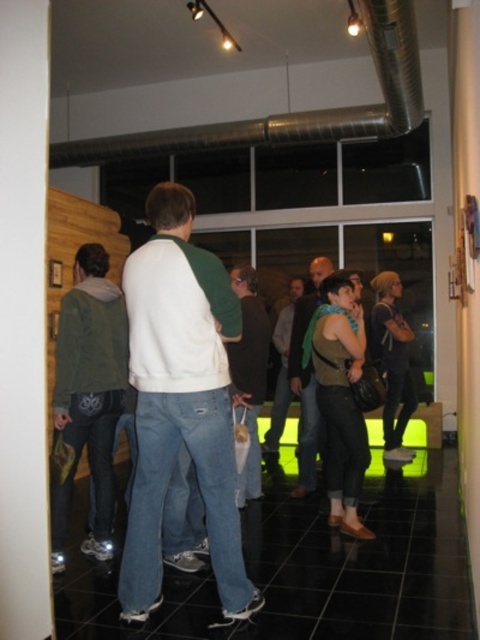
You are organizing a clothing donation drive and need to determine if the white cotton sweater at center can be folded and placed into the green scarf at center. Based on their sizes, can the sweater fit inside the scarf?

The white cotton sweater at center might be wider than green scarf at center, so it is uncertain if the sweater can fit inside the scarf. Further measurement is needed to confirm.

You are organizing a photo shoot and need to ensure that the white cotton sweater at center and the green scarf at center are at least 2 meters apart for proper lighting. Based on the scene, are they currently positioned far enough apart?

The distance between the white cotton sweater at center and the green scarf at center is 1.92 meters, which is slightly less than the required 2 meters. They are not positioned far enough apart for proper lighting.

You are at the center of the room and see both the white cotton sweater at center and the green scarf at center. Which item is positioned higher up?

The white cotton sweater at center is located above the green scarf at center, so it is positioned higher up.